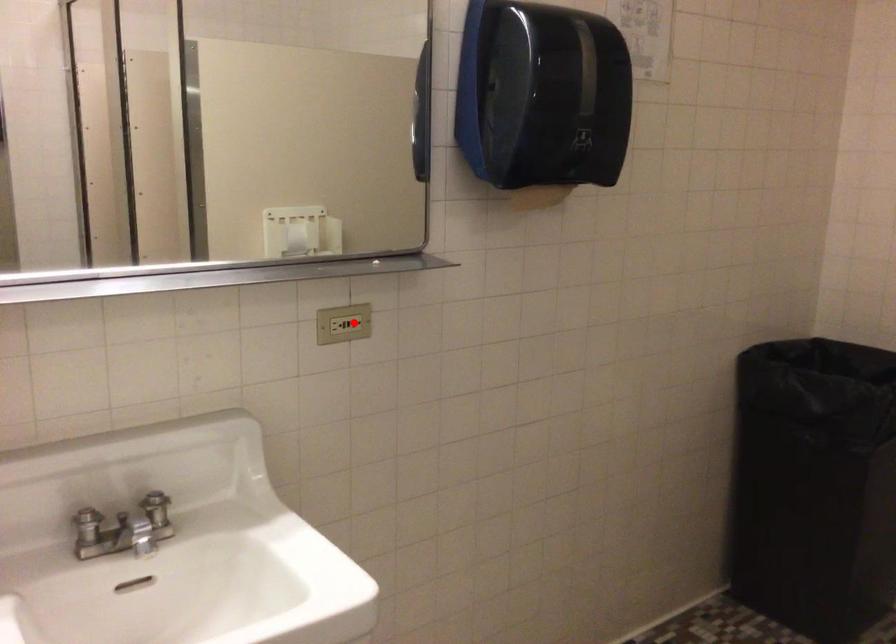
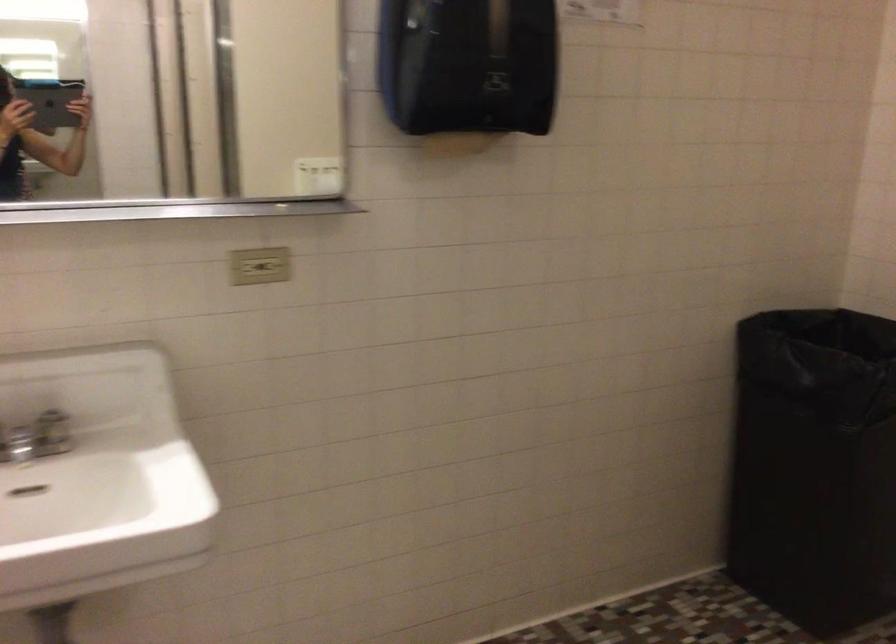
Where in the second image is the point corresponding to the highlighted location from the first image?

(273, 266)